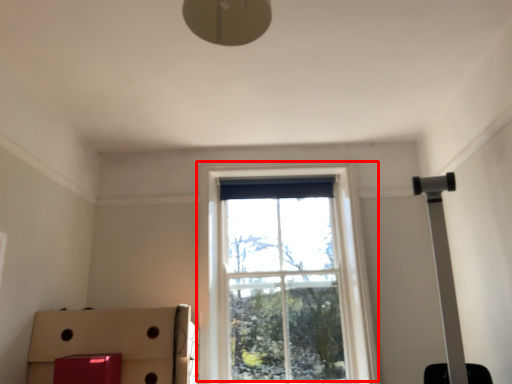
Question: Where is window (annotated by the red box) located in relation to cardboard box in the image?

Choices:
 (A) right
 (B) left

Answer: (A)